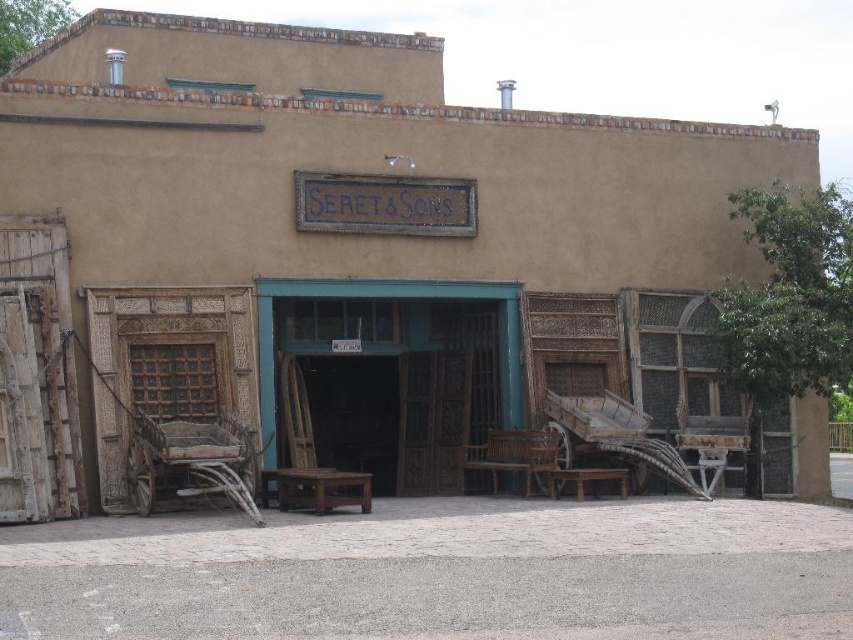
Question: Among these objects, which one is farthest from the camera?

Choices:
 (A) wooden bench at center
 (B) brown wooden bench at center

Answer: (A)

Question: Estimate the real-world distances between objects in this image. Which object is farther from the wooden chair at center?

Choices:
 (A) brown wooden bench at center
 (B) wooden bench at center

Answer: (B)

Question: Can you confirm if wooden chair at center is bigger than brown wooden bench at center?

Choices:
 (A) yes
 (B) no

Answer: (B)

Question: Observing the image, what is the correct spatial positioning of wooden chair at center in reference to brown wooden bench at center?

Choices:
 (A) right
 (B) left

Answer: (A)

Question: Can you confirm if wooden bench at center is smaller than brown wooden bench at center?

Choices:
 (A) yes
 (B) no

Answer: (A)

Question: Which of the following is the closest to the observer?

Choices:
 (A) wooden chair at center
 (B) brown wooden bench at center

Answer: (A)